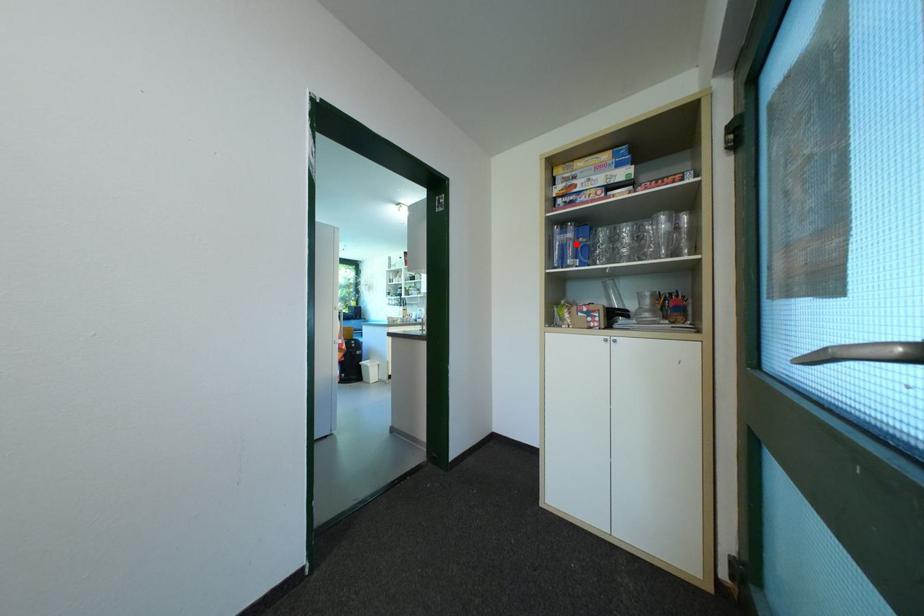
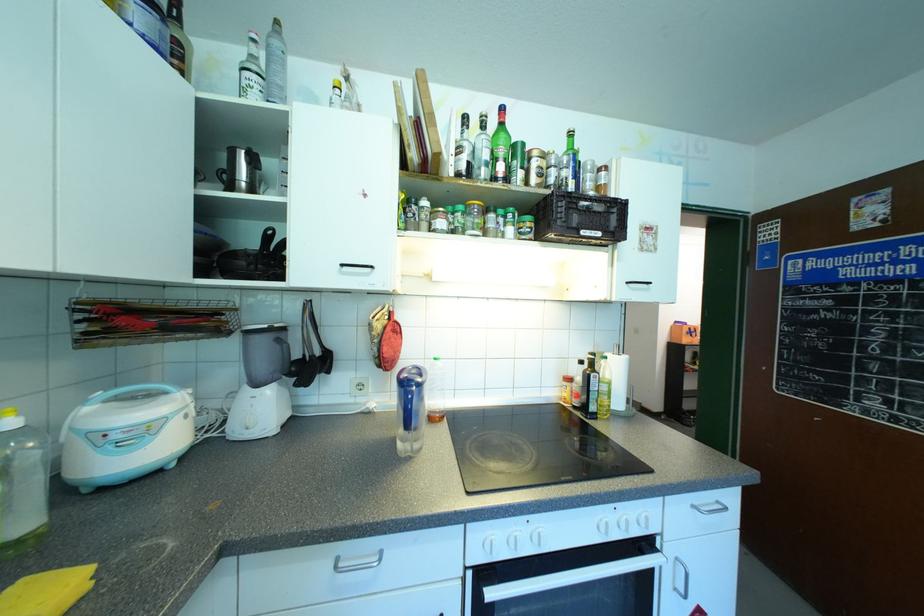
Question: I am providing you with two images of the same scene from different viewpoints. A red point is marked on the first image. Is the red point's position out of view in image 2?

Choices:
 (A) Yes
 (B) No

Answer: (A)